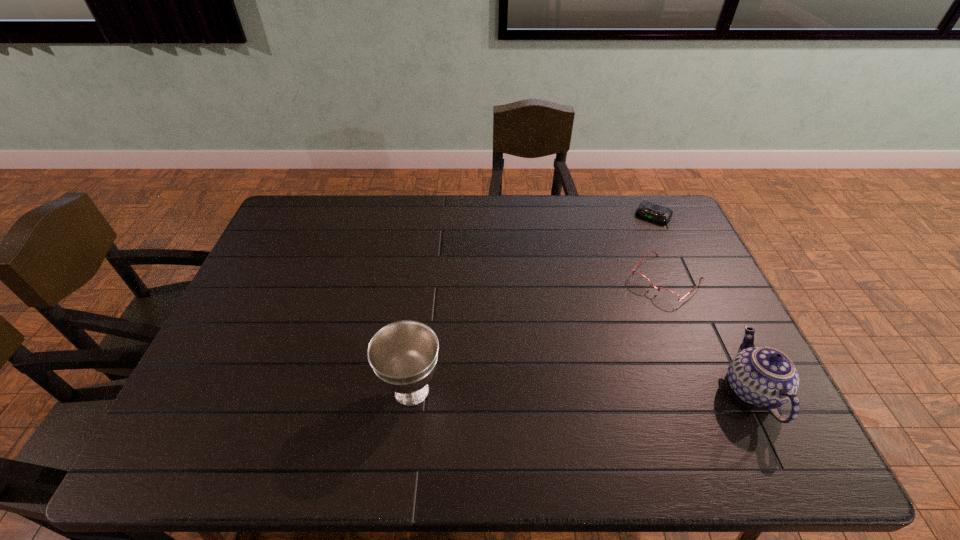
This screenshot has width=960, height=540. I want to click on free space that satisfies the following two spatial constraints: 1. on the front side of the second tallest object; 2. at the spout of the spectacles, so click(712, 389).

This screenshot has width=960, height=540. In order to click on free space in the image that satisfies the following two spatial constraints: 1. on the front side of the spectacles; 2. at the spout of the chinaware in this screenshot , I will do `click(712, 389)`.

Identify the location of vacant area that satisfies the following two spatial constraints: 1. on the back side of the leftmost object; 2. on the right side of the farthest object. (433, 216).

Where is `free spot that satisfies the following two spatial constraints: 1. on the front side of the chinaware; 2. at the spout of the third nearest object`? The width and height of the screenshot is (960, 540). free spot that satisfies the following two spatial constraints: 1. on the front side of the chinaware; 2. at the spout of the third nearest object is located at coordinates (712, 389).

At what (x,y) coordinates should I click in order to perform the action: click on vacant space that satisfies the following two spatial constraints: 1. on the front side of the alarm clock; 2. at the spout of the second tallest object. Please return your answer as a coordinate pair (x, y). The height and width of the screenshot is (540, 960). Looking at the image, I should click on (732, 389).

Locate an element on the screen. blank space that satisfies the following two spatial constraints: 1. on the front side of the third shortest object; 2. at the spout of the third nearest object is located at coordinates (712, 389).